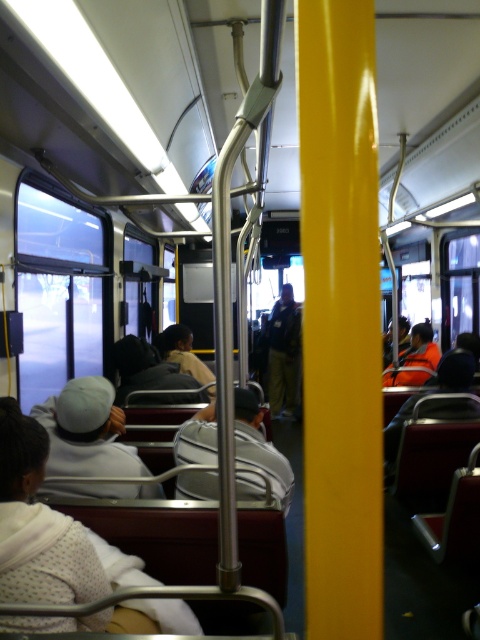
You are a passenger on the bus and you want to pick up both the gray fabric backpack at center and the light brown leather jacket at center. Can you reach both items without moving from your seat?

The gray fabric backpack at center and the light brown leather jacket at center are 2.00 meters apart, so you cannot reach both items without moving from your seat because the distance between them is too large.

You are a passenger sitting in the rear seat of the public transportation vehicle. You need to retrieve your belongings from the overhead compartment. There is a gray fabric backpack at center and a dark gray leather jacket at center. Which item is positioned to the left when looking towards the front of the vehicle?

The gray fabric backpack at center is to the left of the dark gray leather jacket at center when looking towards the front of the vehicle.